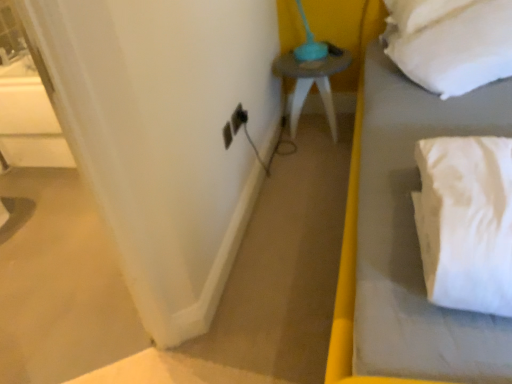
At what (x,y) coordinates should I click in order to perform the action: click on unoccupied region to the right of white fabric curtain at left. Please return your answer as a coordinate pair (x, y). Looking at the image, I should click on (196, 350).